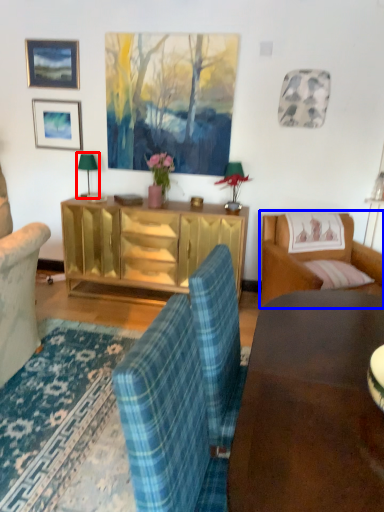
Question: Which object appears farthest to the camera in this image, lamp (highlighted by a red box) or studio couch (highlighted by a blue box)?

Choices:
 (A) lamp
 (B) studio couch

Answer: (A)